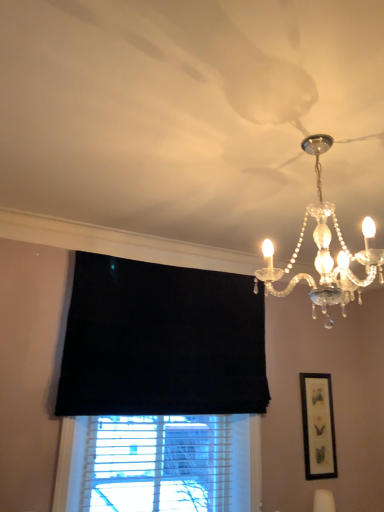
Question: Does clear crystal chandelier at upper right have a lesser width compared to matte black picture frame at right?

Choices:
 (A) yes
 (B) no

Answer: (B)

Question: From a real-world perspective, is clear crystal chandelier at upper right positioned under matte black picture frame at right based on gravity?

Choices:
 (A) no
 (B) yes

Answer: (A)

Question: Is clear crystal chandelier at upper right shorter than matte black picture frame at right?

Choices:
 (A) yes
 (B) no

Answer: (A)

Question: Is clear crystal chandelier at upper right not close to matte black picture frame at right?

Choices:
 (A) yes
 (B) no

Answer: (A)

Question: Is matte black picture frame at right located within clear crystal chandelier at upper right?

Choices:
 (A) no
 (B) yes

Answer: (A)

Question: Can you confirm if clear crystal chandelier at upper right is wider than matte black picture frame at right?

Choices:
 (A) yes
 (B) no

Answer: (A)

Question: Does matte black picture frame at right come in front of clear crystal chandelier at upper right?

Choices:
 (A) no
 (B) yes

Answer: (A)

Question: Is matte black picture frame at right completely or partially outside of clear crystal chandelier at upper right?

Choices:
 (A) no
 (B) yes

Answer: (B)

Question: Does matte black picture frame at right have a larger size compared to clear crystal chandelier at upper right?

Choices:
 (A) yes
 (B) no

Answer: (B)

Question: Is matte black picture frame at right oriented away from clear crystal chandelier at upper right?

Choices:
 (A) no
 (B) yes

Answer: (A)

Question: Does matte black picture frame at right have a greater width compared to clear crystal chandelier at upper right?

Choices:
 (A) no
 (B) yes

Answer: (A)

Question: Considering the relative positions of matte black picture frame at right and clear crystal chandelier at upper right in the image provided, is matte black picture frame at right to the right of clear crystal chandelier at upper right from the viewer's perspective?

Choices:
 (A) yes
 (B) no

Answer: (A)

Question: From a real-world perspective, is matte black picture frame at right positioned above or below clear crystal chandelier at upper right?

Choices:
 (A) below
 (B) above

Answer: (A)